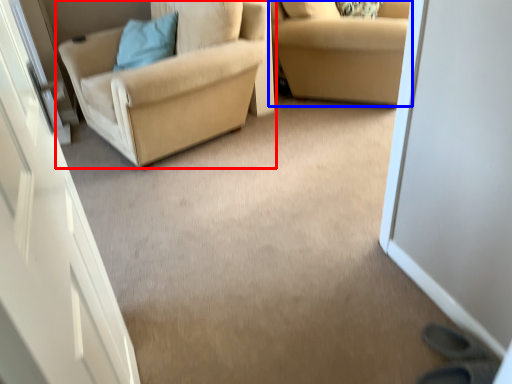
Question: Among these objects, which one is farthest to the camera, chair (highlighted by a red box) or studio couch (highlighted by a blue box)?

Choices:
 (A) chair
 (B) studio couch

Answer: (B)